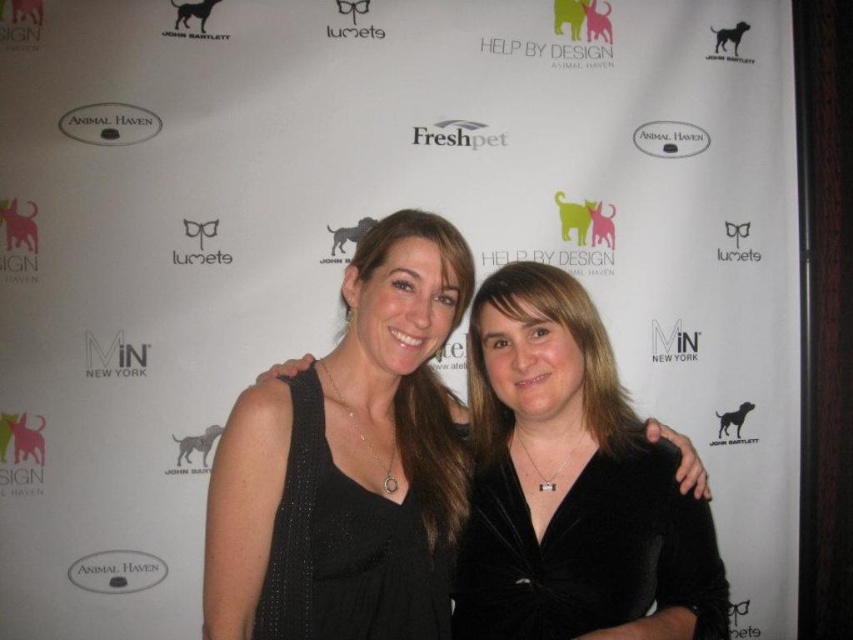
In the scene shown: Is velvet black dress at center bigger than black textured dress at center?

Actually, velvet black dress at center might be smaller than black textured dress at center.

This screenshot has width=853, height=640. Describe the element at coordinates (587, 552) in the screenshot. I see `velvet black dress at center` at that location.

Does point (601, 493) come closer to viewer compared to point (323, 493)?

No, it is not.

I want to click on velvet black dress at center, so click(x=587, y=552).

Who is shorter, black velvet dress at center or black textured dress at center?

Standing shorter between the two is black textured dress at center.

Can you confirm if black velvet dress at center is thinner than black textured dress at center?

No.

Identify the location of black velvet dress at center. This screenshot has width=853, height=640. (349, 461).

Does black velvet dress at center have a lesser height compared to velvet black dress at center?

No.

Which of these two, black velvet dress at center or velvet black dress at center, stands taller?

With more height is black velvet dress at center.

The width and height of the screenshot is (853, 640). Describe the element at coordinates (349, 461) in the screenshot. I see `black velvet dress at center` at that location.

This screenshot has height=640, width=853. I want to click on black velvet dress at center, so click(349, 461).